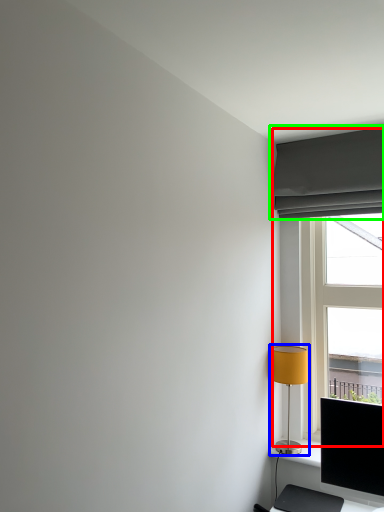
Question: Based on their relative distances, which object is nearer to window (highlighted by a red box)? Choose from lamp (highlighted by a blue box) and curtain (highlighted by a green box).

Choices:
 (A) lamp
 (B) curtain

Answer: (B)